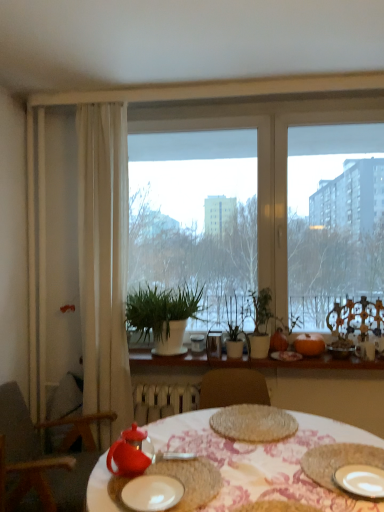
Identify the location of vacant area in front of woven mat at center. This screenshot has width=384, height=512. (248, 460).